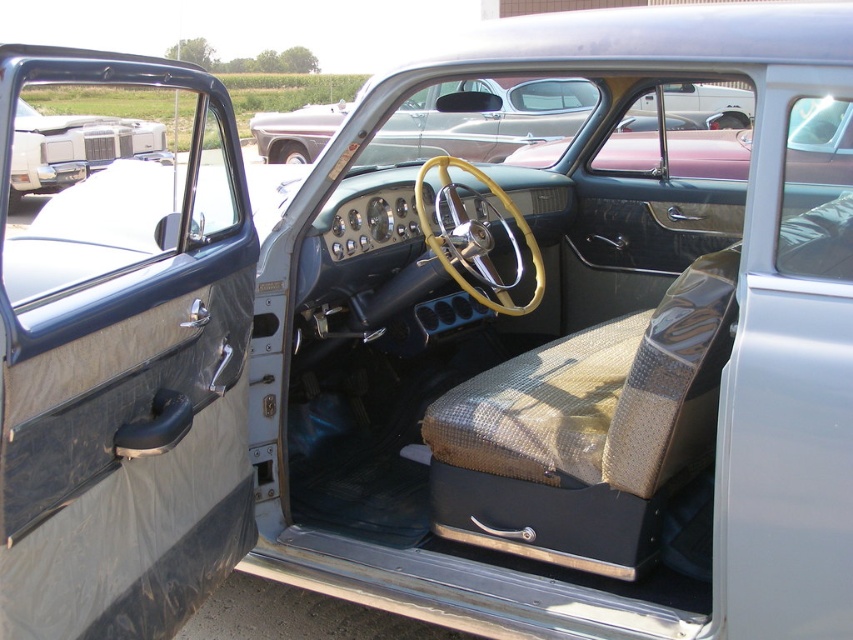
Who is shorter, matte gray door at left or metallic red pickup truck at center?

Standing shorter between the two is metallic red pickup truck at center.

The width and height of the screenshot is (853, 640). Describe the element at coordinates (120, 348) in the screenshot. I see `matte gray door at left` at that location.

This screenshot has width=853, height=640. What are the coordinates of `matte gray door at left` in the screenshot? It's located at (120, 348).